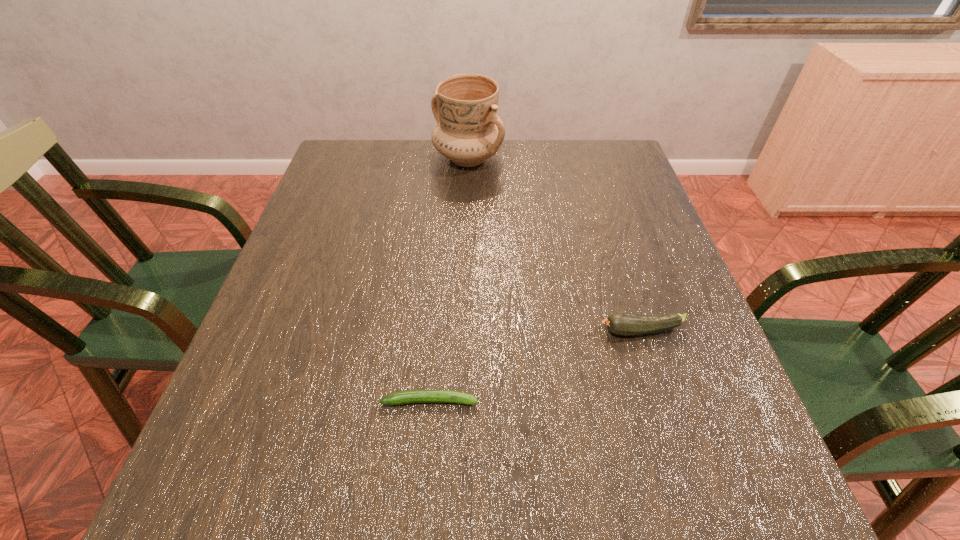
Point out which object is positioned as the second nearest to the second farthest object. Please provide its 2D coordinates. Your answer should be formatted as a tuple, i.e. [(x, y)], where the tuple contains the x and y coordinates of a point satisfying the conditions above.

[(469, 131)]

This screenshot has width=960, height=540. In order to click on vacant area that satisfies the following two spatial constraints: 1. on the front side of the pottery; 2. on the front-facing side of the nearer zucchini in this screenshot , I will do `click(459, 401)`.

Identify the location of free spot that satisfies the following two spatial constraints: 1. on the front side of the pottery; 2. on the front-facing side of the shorter zucchini. (459, 401).